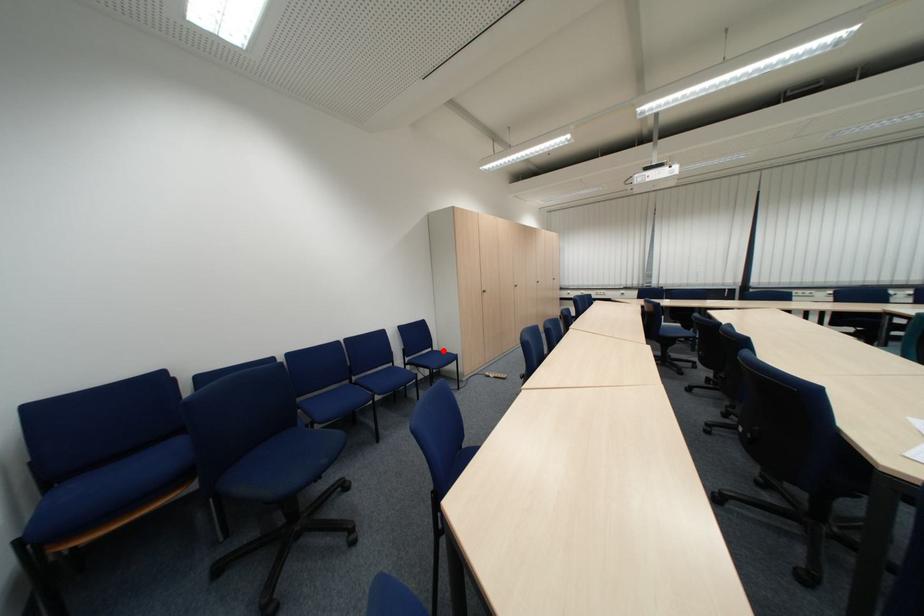
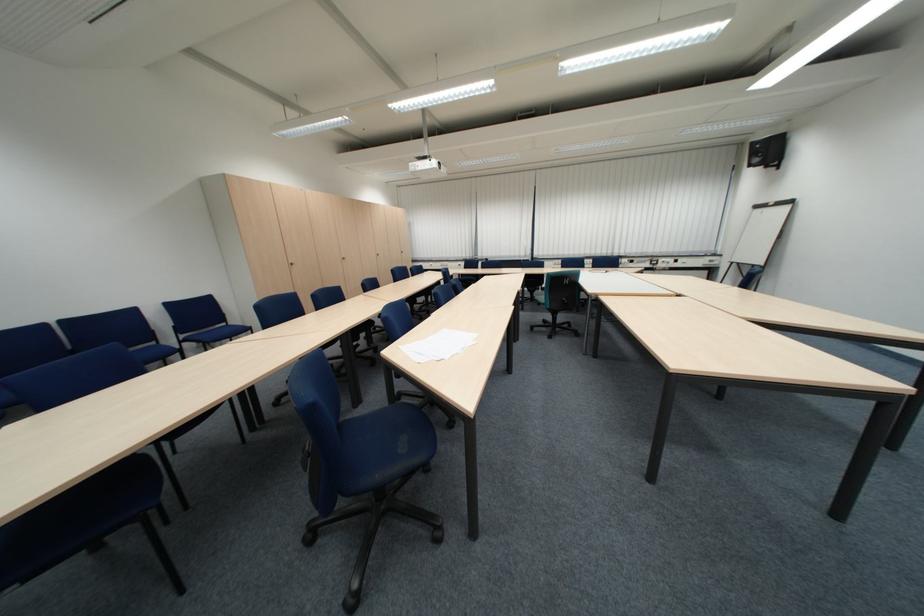
Where in the second image is the point corresponding to the highlighted location from the first image?

(237, 326)